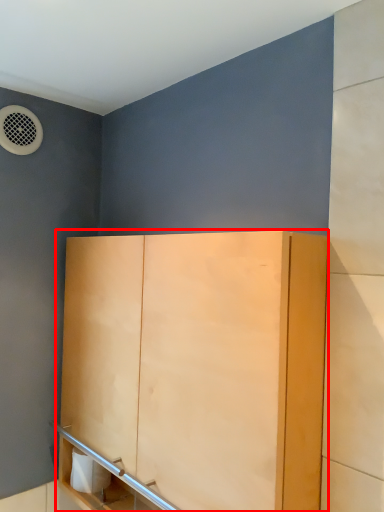
Question: From the image's perspective, what is the correct spatial positioning of cupboard (annotated by the red box) in reference to toilet paper?

Choices:
 (A) above
 (B) below

Answer: (A)